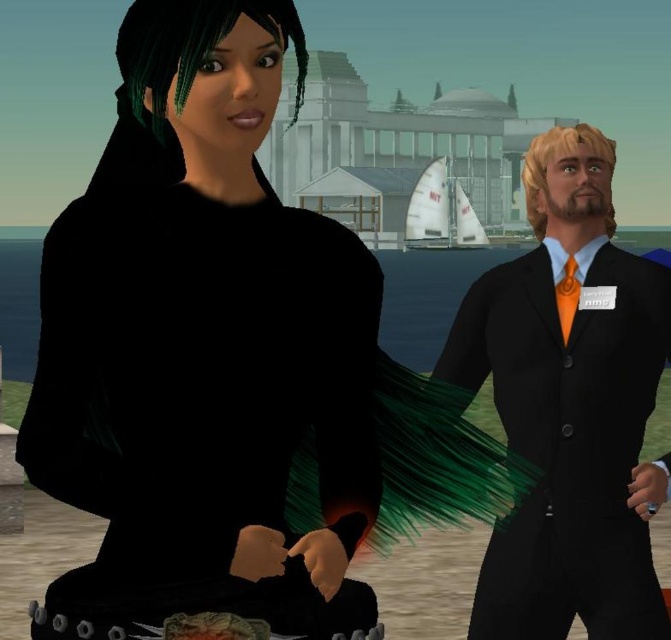
Question: Which point is farther to the camera?

Choices:
 (A) (482, 368)
 (B) (113, 356)

Answer: (A)

Question: Can you confirm if matte black dress at left is thinner than matte black suit at right?

Choices:
 (A) no
 (B) yes

Answer: (B)

Question: Which point appears closest to the camera in this image?

Choices:
 (A) (315, 308)
 (B) (576, 266)

Answer: (A)

Question: From the image, what is the correct spatial relationship of matte black dress at left in relation to matte black suit at right?

Choices:
 (A) right
 (B) left

Answer: (B)

Question: Is matte black dress at left positioned in front of matte black suit at right?

Choices:
 (A) yes
 (B) no

Answer: (A)

Question: Which object appears closest to the camera in this image?

Choices:
 (A) matte black dress at left
 (B) matte black suit at right

Answer: (A)